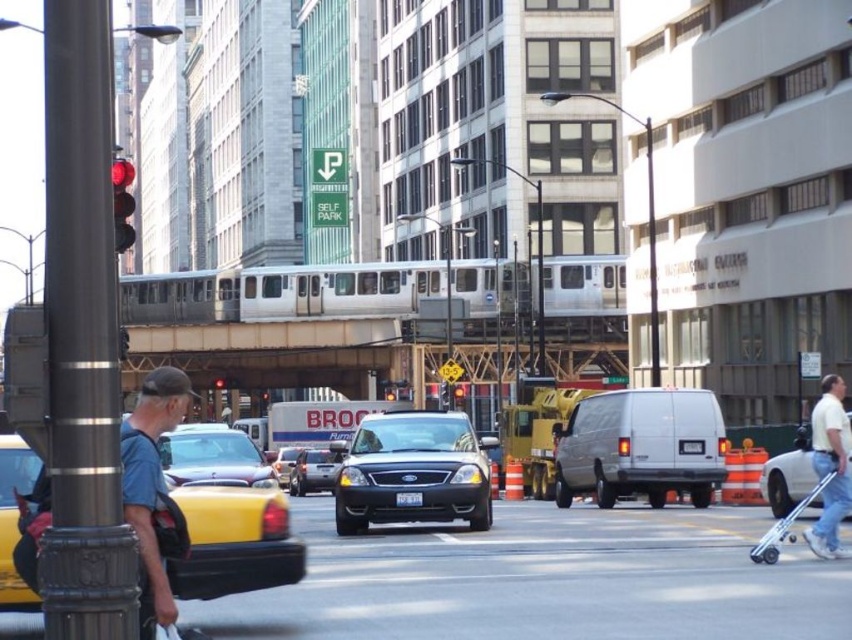
Which is behind, point (125, 189) or point (281, 460)?

The point (281, 460) is more distant.

Is point (110, 172) farther from viewer compared to point (278, 481)?

No, (110, 172) is in front of (278, 481).

Which is behind, point (124, 227) or point (281, 467)?

The point (281, 467) is more distant.

You are a GUI agent. You are given a task and a screenshot of the screen. Output one action in this format:
    pyautogui.click(x=<x>, y=<y>)
    Task: Click on the red glass traffic light at left
    This screenshot has width=852, height=640.
    Given the screenshot: What is the action you would take?
    coord(122,204)

Does yellow rubber taxi at lower left have a larger size compared to metallic silver sedan at center?

Actually, yellow rubber taxi at lower left might be smaller than metallic silver sedan at center.

The height and width of the screenshot is (640, 852). Find the location of `yellow rubber taxi at lower left`. yellow rubber taxi at lower left is located at coordinates (235, 541).

The width and height of the screenshot is (852, 640). I want to click on yellow rubber taxi at lower left, so click(x=235, y=541).

Which is in front, point (639, 486) or point (781, 481)?

Point (781, 481)

Is white matte van at center closer to camera compared to white matte van at right?

No, white matte van at center is further to the viewer.

Which is behind, point (663, 422) or point (798, 490)?

The point (663, 422) is more distant.

Identify the location of white matte van at center. pyautogui.click(x=640, y=445).